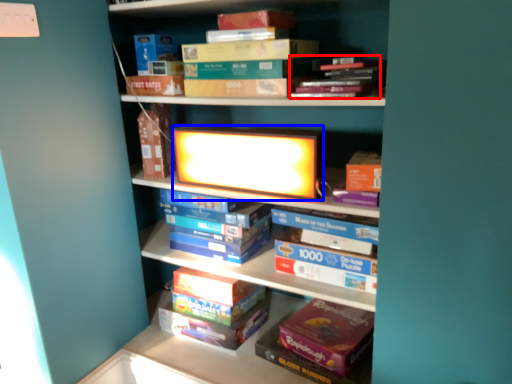
Question: Among these objects, which one is nearest to the camera, book (highlighted by a red box) or book cover (highlighted by a blue box)?

Choices:
 (A) book
 (B) book cover

Answer: (A)